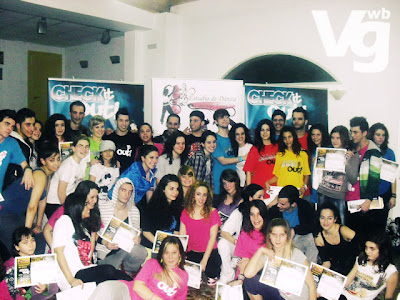
The image size is (400, 300). In order to click on door in this screenshot , I will do `click(50, 66)`.